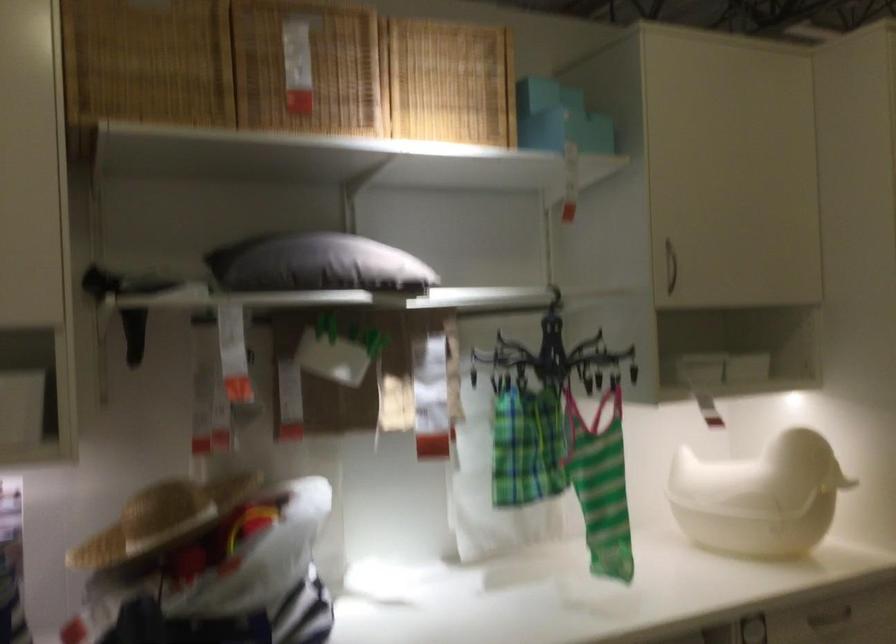
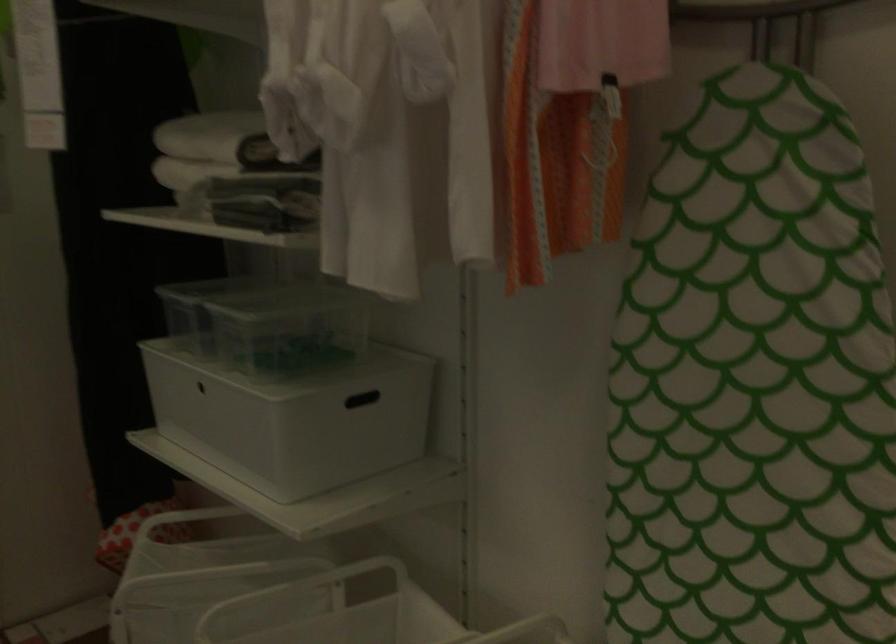
Question: How did the camera likely rotate?

Choices:
 (A) Left
 (B) Right
 (C) Up
 (D) Down

Answer: (B)